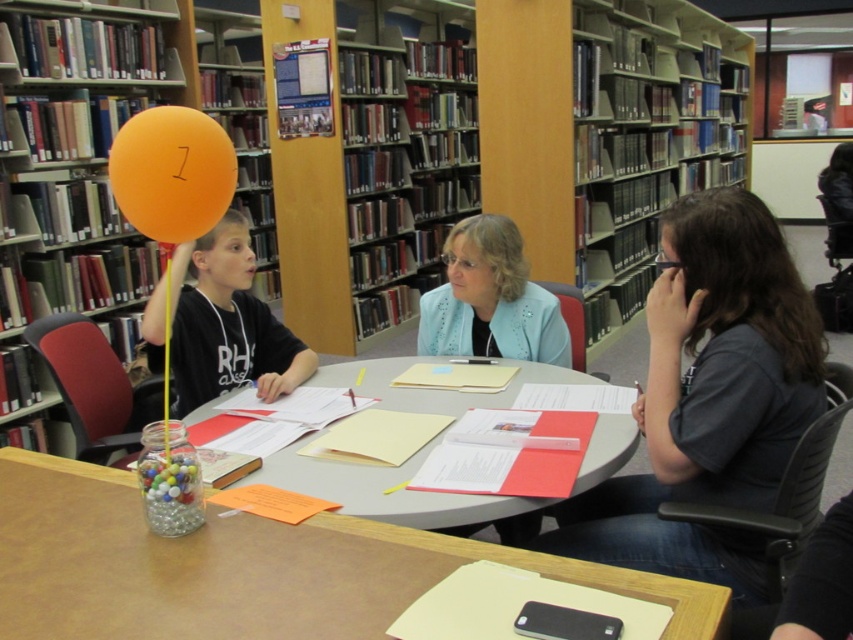
Can you confirm if wooden table at center is bigger than orange matte balloon at upper left?

Correct, wooden table at center is larger in size than orange matte balloon at upper left.

Is the position of wooden table at center more distant than that of orange matte balloon at upper left?

No.

Is point (664, 628) farther from viewer compared to point (115, 154)?

No, it is in front of (115, 154).

This screenshot has height=640, width=853. I want to click on wooden table at center, so click(244, 566).

Between matte black shirt at center and orange matte balloon at upper left, which one appears on the left side from the viewer's perspective?

From the viewer's perspective, matte black shirt at center appears more on the left side.

Who is more forward, (x=198, y=362) or (x=183, y=170)?

Point (x=183, y=170) is in front.

At what (x,y) coordinates should I click in order to perform the action: click on matte black shirt at center. Please return your answer as a coordinate pair (x, y). Looking at the image, I should click on (227, 323).

Who is higher up, wooden bookshelf at left or blue fabric jacket at center?

wooden bookshelf at left is above.

Is wooden bookshelf at left in front of blue fabric jacket at center?

No, wooden bookshelf at left is behind blue fabric jacket at center.

Between point (32, 17) and point (496, 308), which one is positioned in front?

Point (496, 308) is in front.

Where is `wooden bookshelf at left`? wooden bookshelf at left is located at coordinates (74, 176).